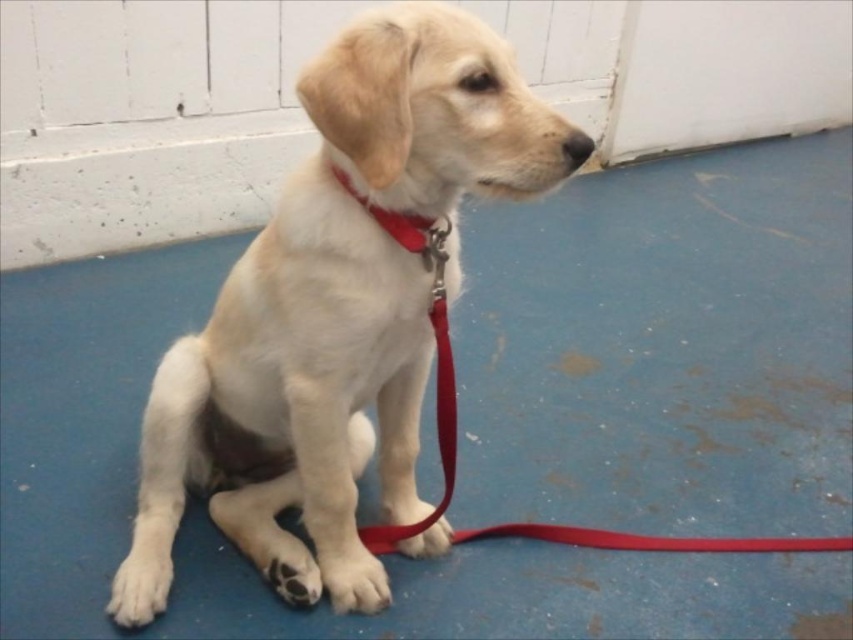
Does white fur dog at center come in front of red leather leash at center?

Yes, white fur dog at center is in front of red leather leash at center.

Between white fur dog at center and red leather leash at center, which one has less height?

With less height is red leather leash at center.

Who is more distant from viewer, (476, 152) or (349, 189)?

Positioned behind is point (349, 189).

Find the location of `white fur dog at center`. white fur dog at center is located at coordinates (335, 310).

Is white fur dog at center taller than matte nylon collar at center?

Correct, white fur dog at center is much taller as matte nylon collar at center.

Between white fur dog at center and matte nylon collar at center, which one has less height?

With less height is matte nylon collar at center.

Locate an element on the screen. white fur dog at center is located at coordinates (335, 310).

Can you confirm if red leather leash at center is positioned to the right of matte nylon collar at center?

Correct, you'll find red leather leash at center to the right of matte nylon collar at center.

Looking at this image, which is below, red leather leash at center or matte nylon collar at center?

red leather leash at center

At what (x,y) coordinates should I click in order to perform the action: click on red leather leash at center. Please return your answer as a coordinate pair (x, y). Looking at the image, I should click on [434, 352].